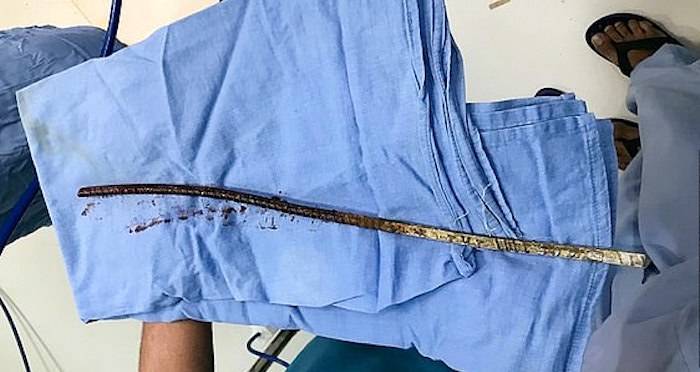
Identify the location of blanket. (328, 136).